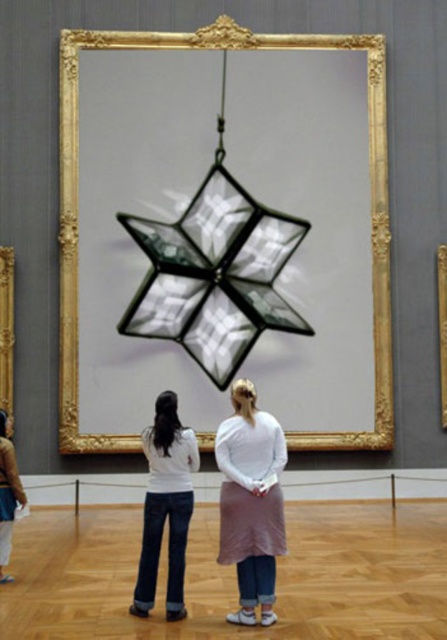
Can you confirm if gold/gilded wood picture frame at upper center is smaller than gold/gilded wood picture frame at center?

Incorrect, gold/gilded wood picture frame at upper center is not smaller in size than gold/gilded wood picture frame at center.

Is point (8, 342) behind point (441, 337)?

No.

At what (x,y) coordinates should I click in order to perform the action: click on gold/gilded wood picture frame at upper center. Please return your answer as a coordinate pair (x, y). The height and width of the screenshot is (640, 447). Looking at the image, I should click on (7, 332).

From the picture: Between gold/gilded picture frame at center and gold/gilded wood picture frame at center, which one has more height?

gold/gilded picture frame at center is taller.

Does point (371, 196) come in front of point (446, 362)?

No.

What do you see at coordinates (77, 220) in the screenshot? I see `gold/gilded picture frame at center` at bounding box center [77, 220].

Find the location of a particular element. This screenshot has height=640, width=447. gold/gilded picture frame at center is located at coordinates (x=77, y=220).

Which is more to the left, denim jeans at lower left or gold/gilded wood picture frame at upper center?

Positioned to the left is gold/gilded wood picture frame at upper center.

Is point (4, 460) in front of point (0, 337)?

Yes, it is in front of point (0, 337).

What do you see at coordinates (8, 492) in the screenshot?
I see `denim jeans at lower left` at bounding box center [8, 492].

Identify the location of denim jeans at lower left. (8, 492).